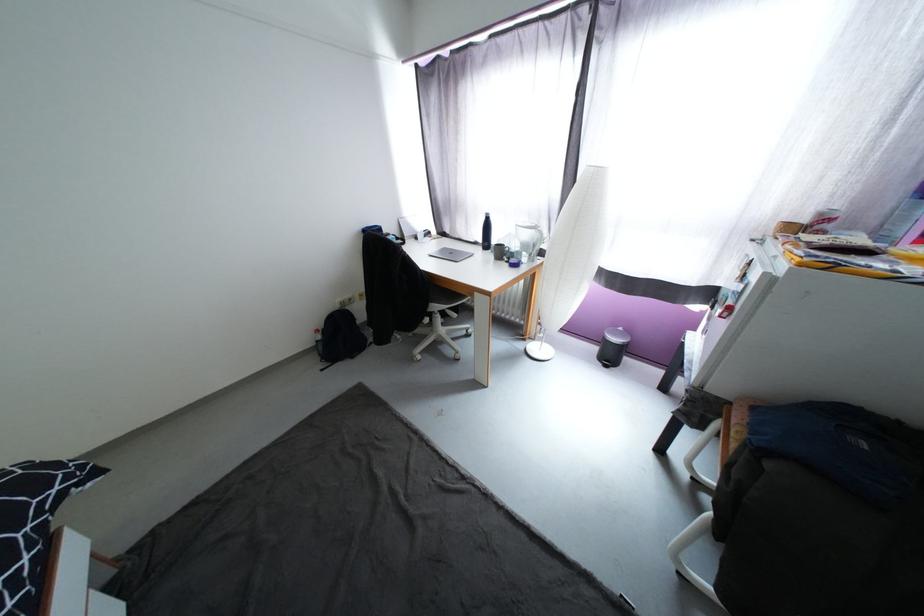
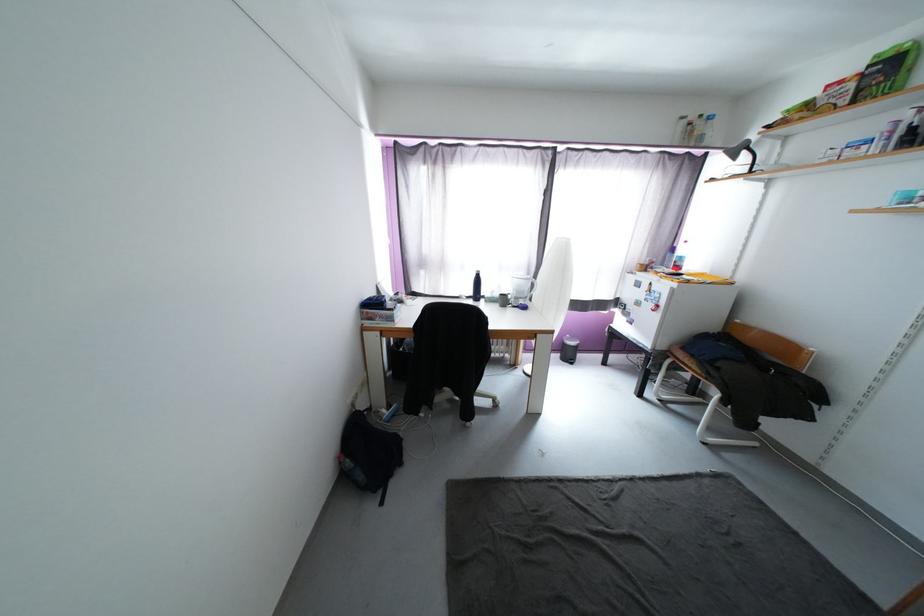
The point at (601, 350) is marked in the first image. Where is the corresponding point in the second image?

(564, 357)